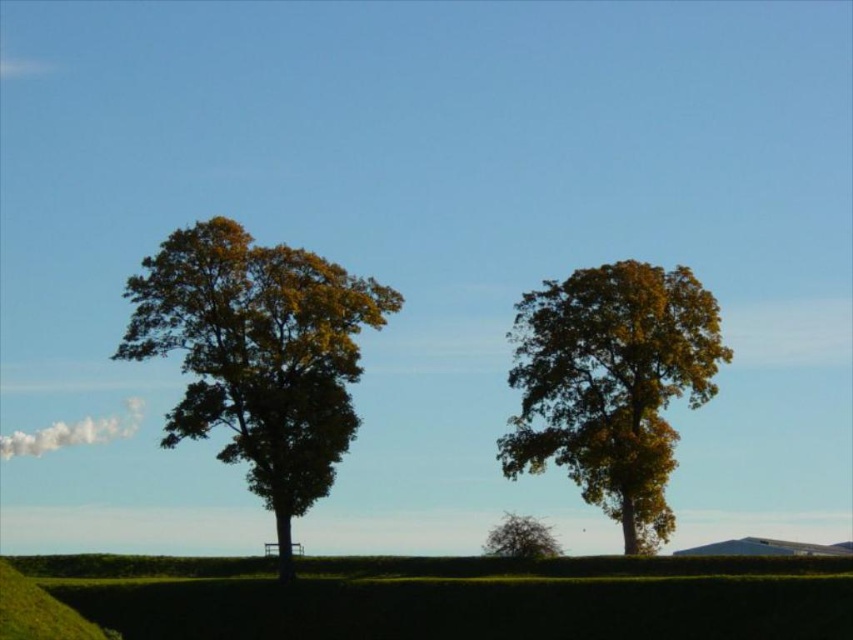
Can you confirm if green leafy tree at left is positioned below green leafy tree at lower center?

Actually, green leafy tree at left is above green leafy tree at lower center.

The width and height of the screenshot is (853, 640). What do you see at coordinates (257, 355) in the screenshot?
I see `green leafy tree at left` at bounding box center [257, 355].

Identify the location of green leafy tree at left. This screenshot has height=640, width=853. (257, 355).

Does green grassy hillside at lower center appear on the right side of green leafy tree at left?

In fact, green grassy hillside at lower center is to the left of green leafy tree at left.

The height and width of the screenshot is (640, 853). What are the coordinates of `green grassy hillside at lower center` in the screenshot? It's located at (427, 596).

Locate an element on the screen. This screenshot has height=640, width=853. green grassy hillside at lower center is located at coordinates [427, 596].

Is green leafy tree at left behind golden textured tree at center?

Yes, it is.

Does green leafy tree at left have a larger size compared to golden textured tree at center?

No.

Who is more forward, (x=181, y=307) or (x=665, y=344)?

Point (x=665, y=344) is more forward.

The height and width of the screenshot is (640, 853). Identify the location of green leafy tree at left. (257, 355).